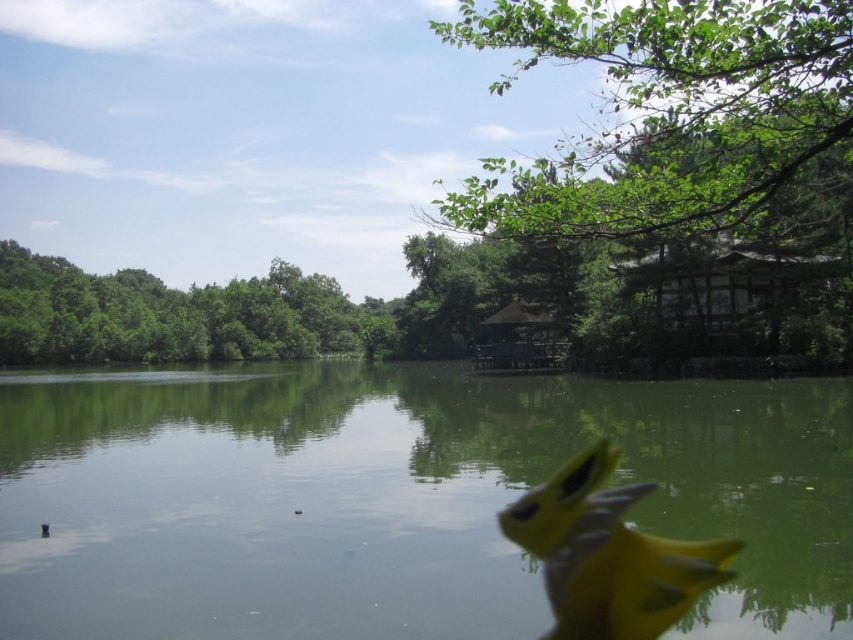
You are an ornithologist observing a yellow matte bird at center and green leafy trees at upper left in the lakeside scene. Which object is closer to the observer?

The green leafy trees at upper left are closer to the observer because the yellow matte bird at center is positioned behind them.

You are standing at the yellow object resembling a toy or figurine in the lower right corner of the lakeside scene. Looking towards the upper right corner, can you see the green leafy tree marked by point (664, 112)?

Yes, the point (664, 112) marks the green leafy tree at upper right, so from the yellow object resembling a toy or figurine in the lower right corner, you can see the green leafy tree at upper right.